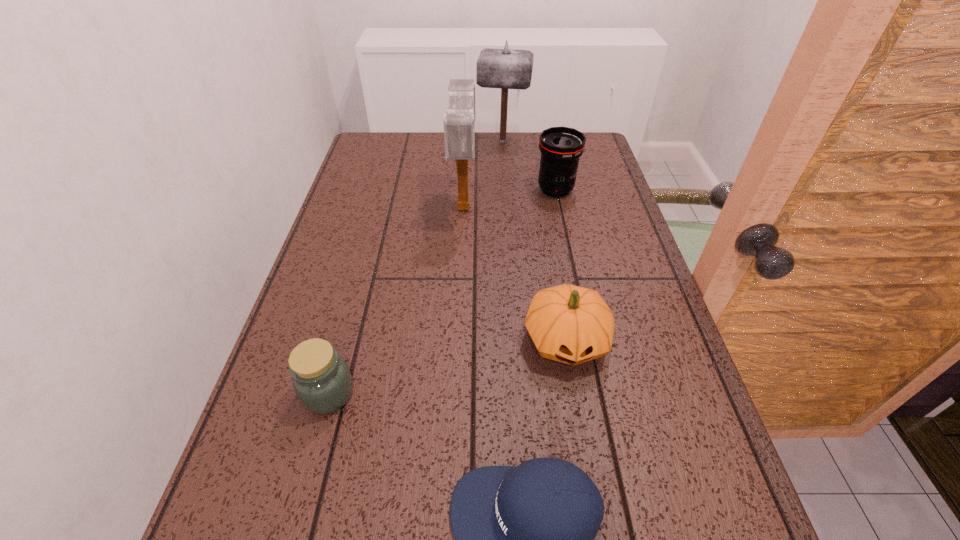
This screenshot has width=960, height=540. Identify the location of free area in between the telephoto lens and the jar. (443, 292).

Find the location of a particular element. Image resolution: width=960 pixels, height=540 pixels. free space between the gourd and the telephoto lens is located at coordinates (561, 265).

Where is `vacant area that lies between the leftmost object and the nearer mallet`? vacant area that lies between the leftmost object and the nearer mallet is located at coordinates (396, 300).

You are a GUI agent. You are given a task and a screenshot of the screen. Output one action in this format:
    pyautogui.click(x=<x>, y=<y>)
    Task: Click on the free point between the nearer mallet and the telephoto lens
    
    Given the screenshot: What is the action you would take?
    pyautogui.click(x=510, y=198)

Where is `vacant area that lies between the gourd and the farther mallet`? This screenshot has width=960, height=540. vacant area that lies between the gourd and the farther mallet is located at coordinates (534, 240).

This screenshot has height=540, width=960. Identify the location of vacant area that lies between the gourd and the nearer mallet. (515, 274).

Find the location of a particular element. The height and width of the screenshot is (540, 960). free space between the gourd and the telephoto lens is located at coordinates (561, 265).

At what (x,y) coordinates should I click in order to perform the action: click on object that is the third closest to the left mallet. Please return your answer as a coordinate pair (x, y). This screenshot has width=960, height=540. Looking at the image, I should click on (570, 324).

This screenshot has height=540, width=960. What are the coordinates of `the fourth closest object to the right mallet` in the screenshot? It's located at click(322, 381).

This screenshot has width=960, height=540. Identify the location of free location that satisfies the following two spatial constraints: 1. on the back side of the left mallet; 2. on the right side of the fifth tallest object. (379, 207).